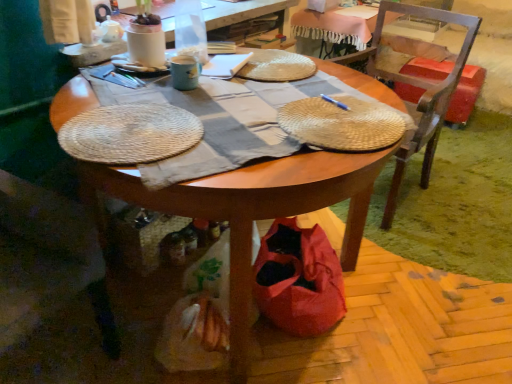
Where is `free space in front of matte ceramic mug at upper center`? This screenshot has height=384, width=512. free space in front of matte ceramic mug at upper center is located at coordinates (186, 92).